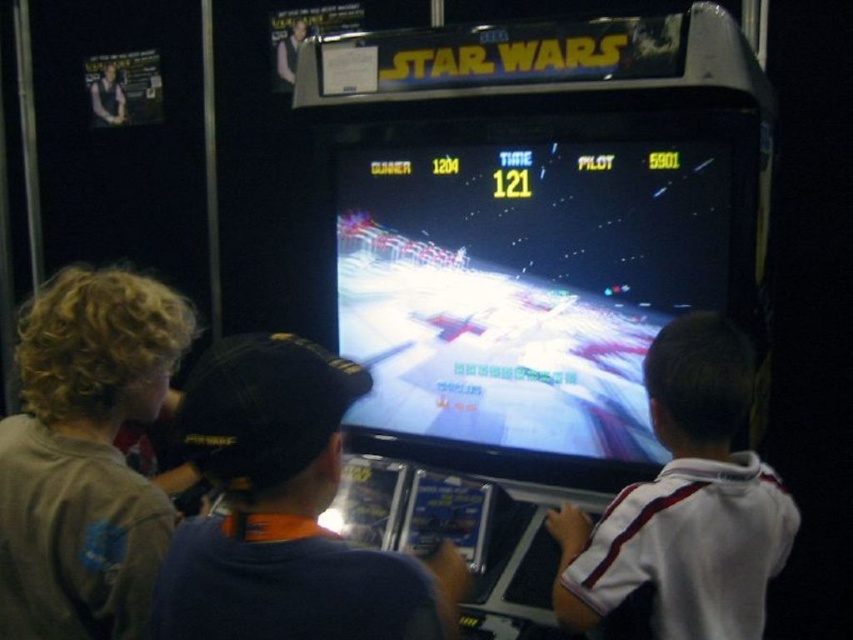
Question: Among these points, which one is farthest from the camera?

Choices:
 (A) (669, 547)
 (B) (103, 320)

Answer: (B)

Question: Is brown cotton shirt at left bigger than white striped shirt at center?

Choices:
 (A) no
 (B) yes

Answer: (A)

Question: Among these points, which one is nearest to the camera?

Choices:
 (A) (592, 452)
 (B) (196, 522)

Answer: (B)

Question: Does shiny plastic arcade machine at center have a lesser width compared to white striped shirt at center?

Choices:
 (A) yes
 (B) no

Answer: (B)

Question: Does shiny plastic arcade machine at center appear under white striped shirt at center?

Choices:
 (A) no
 (B) yes

Answer: (A)

Question: Which object appears farthest from the camera in this image?

Choices:
 (A) brown cotton shirt at left
 (B) white striped shirt at center

Answer: (B)